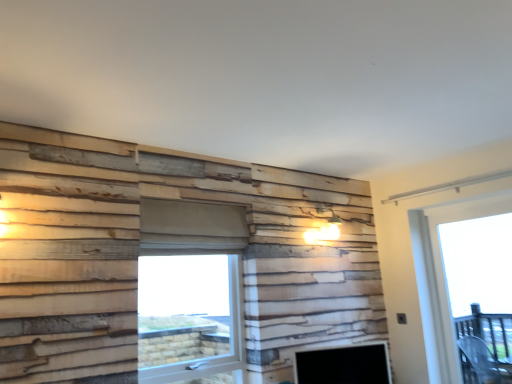
Question: Does transparent plastic window screen at center have a greater width compared to matte black fireplace at lower center?

Choices:
 (A) yes
 (B) no

Answer: (A)

Question: Is transparent plastic window screen at center facing towards matte black fireplace at lower center?

Choices:
 (A) no
 (B) yes

Answer: (A)

Question: From a real-world perspective, is transparent plastic window screen at center located higher than matte black fireplace at lower center?

Choices:
 (A) no
 (B) yes

Answer: (B)

Question: From the image's perspective, does transparent plastic window screen at center appear lower than matte black fireplace at lower center?

Choices:
 (A) no
 (B) yes

Answer: (A)

Question: Can you confirm if transparent plastic window screen at center is bigger than matte black fireplace at lower center?

Choices:
 (A) yes
 (B) no

Answer: (A)

Question: Considering the positions of transparent glass door at right and transparent plastic window screen at center in the image, is transparent glass door at right wider or thinner than transparent plastic window screen at center?

Choices:
 (A) thin
 (B) wide

Answer: (A)

Question: In the image, is transparent glass door at right positioned in front of or behind transparent plastic window screen at center?

Choices:
 (A) behind
 (B) front

Answer: (A)

Question: From a real-world perspective, relative to transparent plastic window screen at center, is transparent glass door at right vertically above or below?

Choices:
 (A) below
 (B) above

Answer: (B)

Question: Choose the correct answer: Is transparent glass door at right inside transparent plastic window screen at center or outside it?

Choices:
 (A) inside
 (B) outside

Answer: (B)

Question: Is matte black fireplace at lower center inside or outside of transparent plastic window screen at center?

Choices:
 (A) outside
 (B) inside

Answer: (A)

Question: From their relative heights in the image, would you say matte black fireplace at lower center is taller or shorter than transparent plastic window screen at center?

Choices:
 (A) short
 (B) tall

Answer: (A)

Question: In the image, is matte black fireplace at lower center positioned in front of or behind transparent plastic window screen at center?

Choices:
 (A) behind
 (B) front

Answer: (A)

Question: Considering the positions of matte black fireplace at lower center and transparent plastic window screen at center in the image, is matte black fireplace at lower center wider or thinner than transparent plastic window screen at center?

Choices:
 (A) thin
 (B) wide

Answer: (A)

Question: Is transparent glass door at right spatially inside matte black fireplace at lower center, or outside of it?

Choices:
 (A) outside
 (B) inside

Answer: (A)

Question: From a real-world perspective, relative to matte black fireplace at lower center, is transparent glass door at right vertically above or below?

Choices:
 (A) above
 (B) below

Answer: (A)